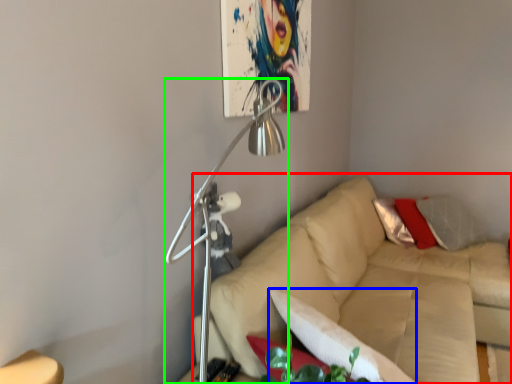
Question: Which object is the farthest from studio couch (highlighted by a red box)? Choose among these: pillow (highlighted by a blue box) or lamp (highlighted by a green box).

Choices:
 (A) pillow
 (B) lamp

Answer: (B)